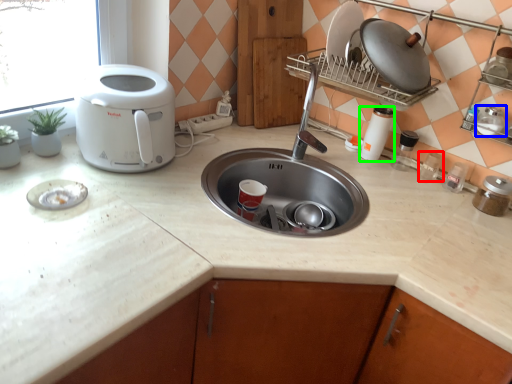
Question: Considering the real-world distances, which object is farthest from appliance (highlighted by a red box)? appliance (highlighted by a blue box) or appliance (highlighted by a green box)?

Choices:
 (A) appliance
 (B) appliance

Answer: (A)